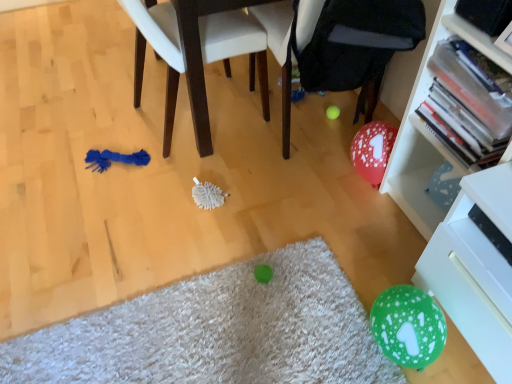
Find the location of a particular element. empty space that is in between blue fabric chair at left and green fuzzy mat at lower center is located at coordinates (174, 226).